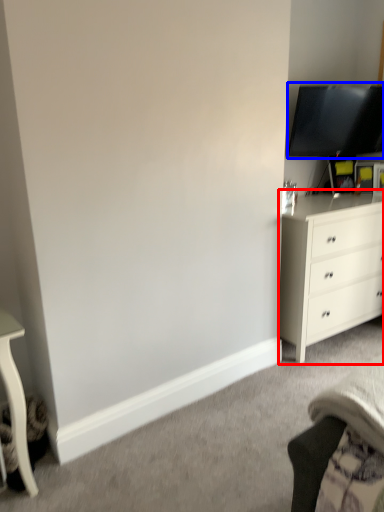
Question: Among these objects, which one is nearest to the camera, chest of drawers (highlighted by a red box) or television (highlighted by a blue box)?

Choices:
 (A) chest of drawers
 (B) television

Answer: (A)